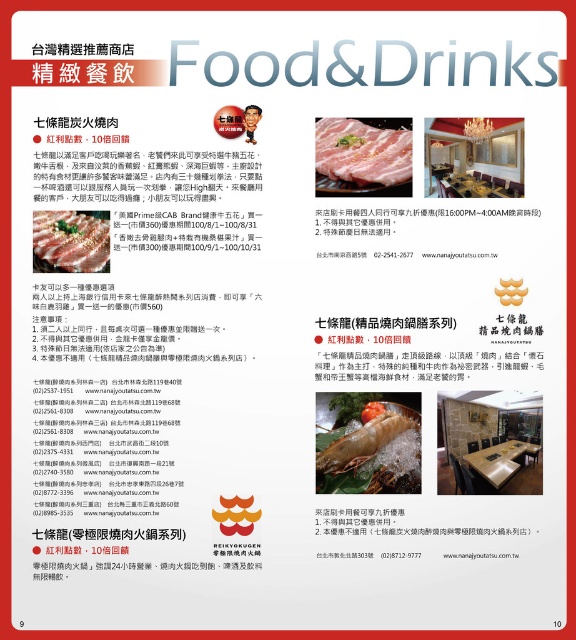
This screenshot has width=576, height=640. What do you see at coordinates (369, 445) in the screenshot?
I see `white glossy prawns at center` at bounding box center [369, 445].

Does white glossy prawns at center have a greater height compared to matte black pork belly at center?

Correct, white glossy prawns at center is much taller as matte black pork belly at center.

The image size is (576, 640). Describe the element at coordinates (369, 445) in the screenshot. I see `white glossy prawns at center` at that location.

What are the coordinates of `white glossy prawns at center` in the screenshot? It's located at (369, 445).

Which is above, white glossy prawns at center or pinkish-white meat at center?

pinkish-white meat at center is above.

Measure the distance between point (350, 456) and camera.

They are 1.09 meters apart.

Locate an element on the screen. The height and width of the screenshot is (640, 576). white glossy prawns at center is located at coordinates (369, 445).

Is matte black table at center positioned at the back of matte black pork belly at center?

Yes, matte black table at center is behind matte black pork belly at center.

Between point (513, 176) and point (96, 256), which one is positioned in front?

Point (96, 256) is in front.

I want to click on matte black table at center, so click(475, 157).